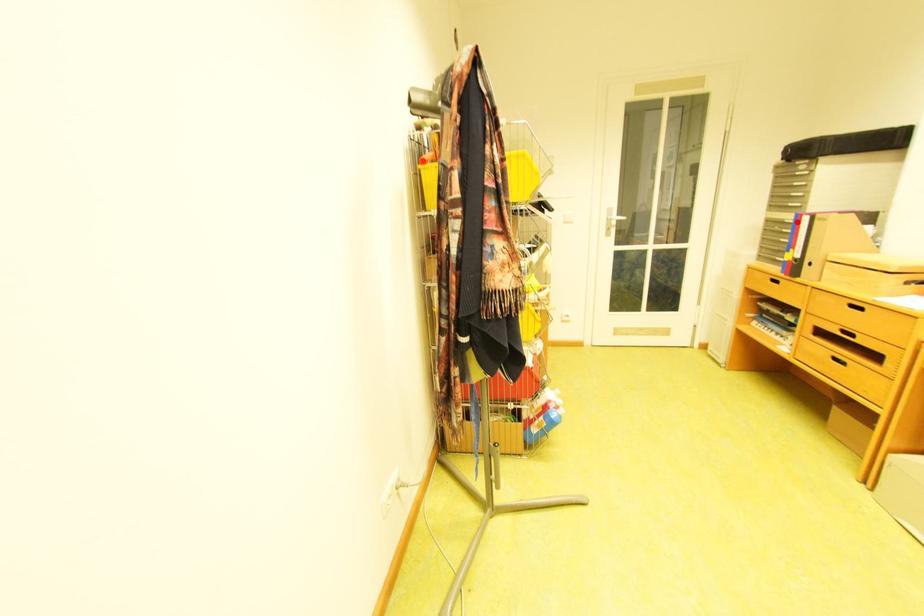
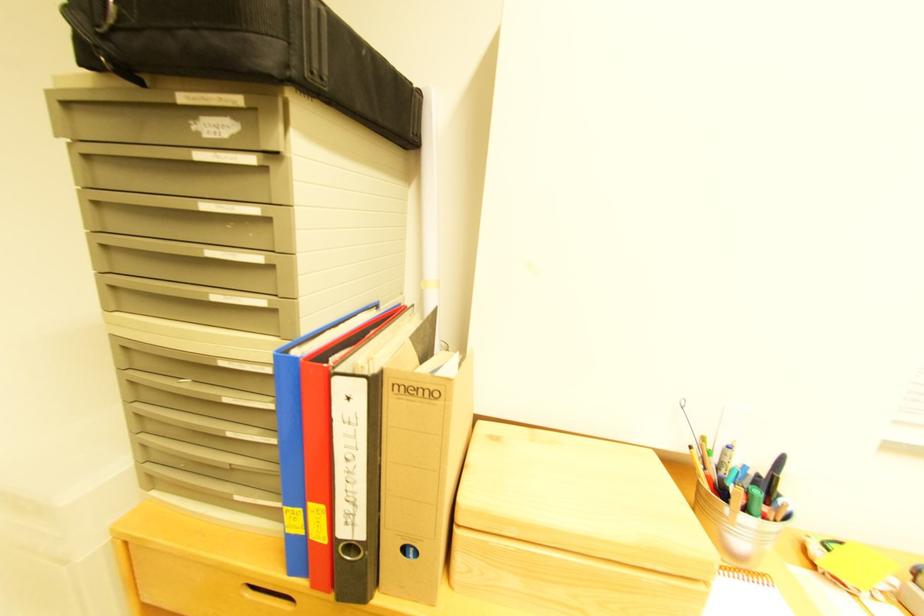
Locate, in the second image, the point that corresponds to the highlighted location in the first image.

(235, 363)